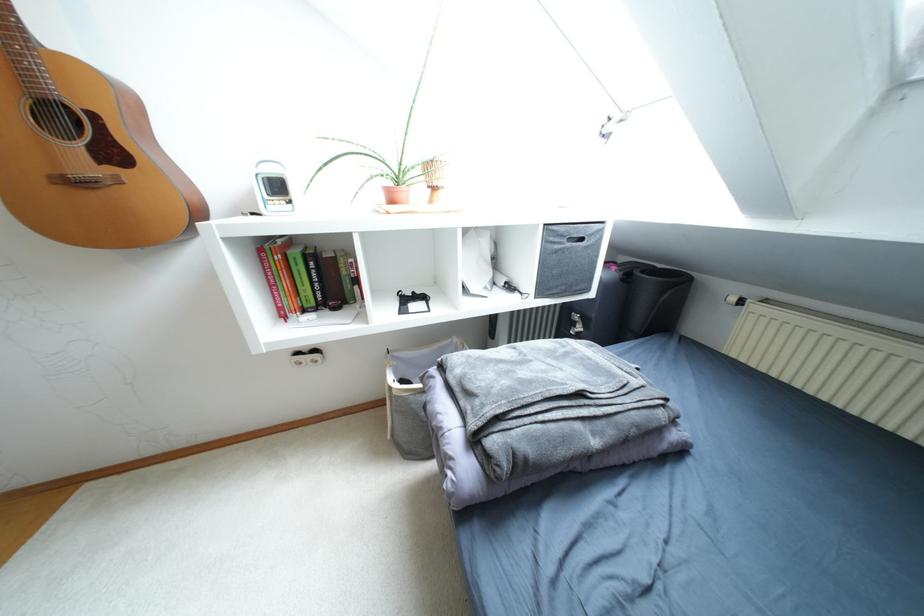
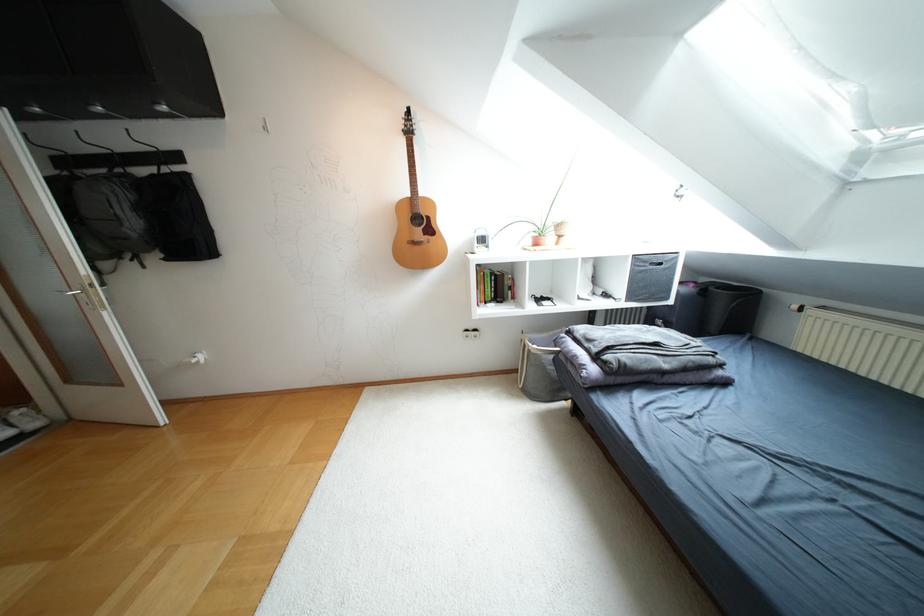
Locate, in the second image, the point that corresponds to (x=294, y=253) in the first image.

(487, 272)